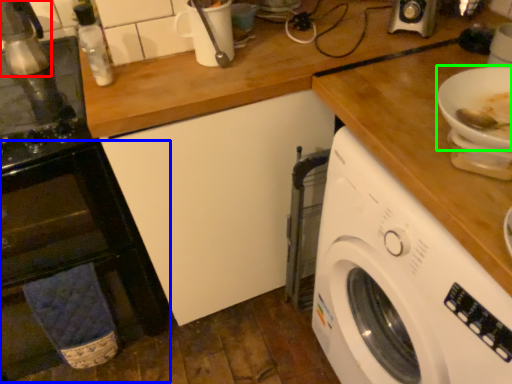
Question: Based on their relative distances, which object is farther from appliance (highlighted by a red box)? Choose from oven (highlighted by a blue box) and bowl (highlighted by a green box).

Choices:
 (A) oven
 (B) bowl

Answer: (B)